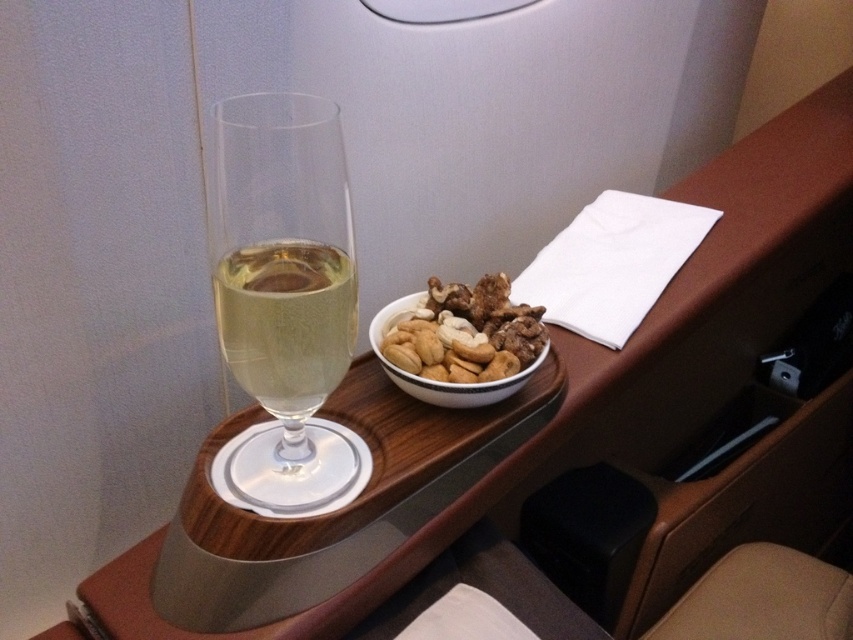
You are a flight attendant checking the tray tables. You need to place a napkin exactly at the center of the tray table. The tray table is a rectangle. Where should you place the napkin relative to the clear glass wine glass at center?

The clear glass wine glass at center is already positioned at the center of the tray table, so placing the napkin exactly at the same location as the clear glass wine glass at center would center it on the tray table.